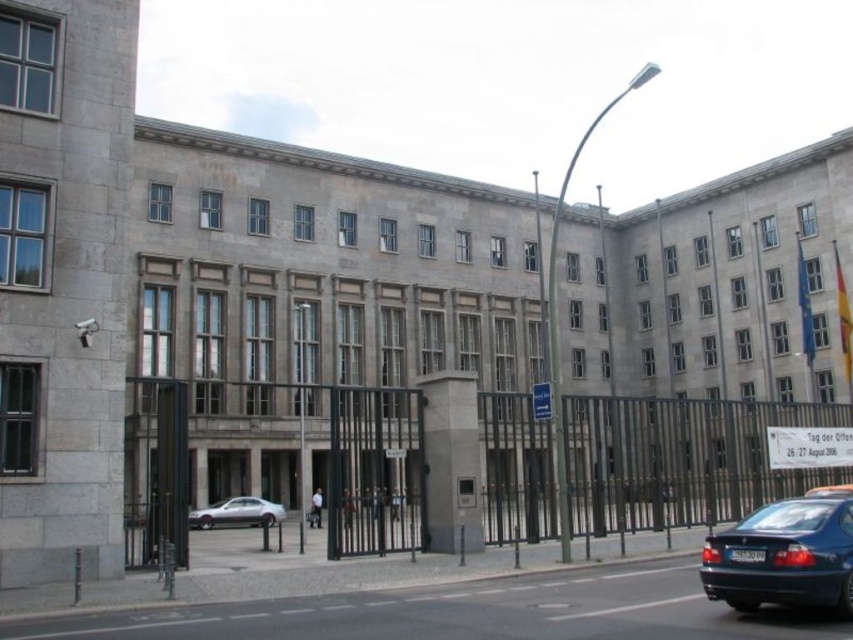
Question: Estimate the real-world distances between objects in this image. Which object is farther from the shiny blue sedan at lower right?

Choices:
 (A) metallic silver taxi at center
 (B) silver metallic car at lower left
 (C) black metal fence at center

Answer: (B)

Question: Which object is farther from the camera taking this photo?

Choices:
 (A) metallic silver taxi at center
 (B) black metal fence at center
 (C) silver metallic car at lower left
 (D) shiny blue sedan at lower right

Answer: (C)

Question: From the image, what is the correct spatial relationship of silver metallic car at lower left in relation to metallic silver taxi at center?

Choices:
 (A) left
 (B) right

Answer: (A)

Question: Is black metal fence at center thinner than metallic silver taxi at center?

Choices:
 (A) yes
 (B) no

Answer: (B)

Question: Is black metal fence at center bigger than metallic silver taxi at center?

Choices:
 (A) yes
 (B) no

Answer: (A)

Question: Which is farther from the shiny blue sedan at lower right?

Choices:
 (A) black metal fence at center
 (B) metallic silver taxi at center

Answer: (A)